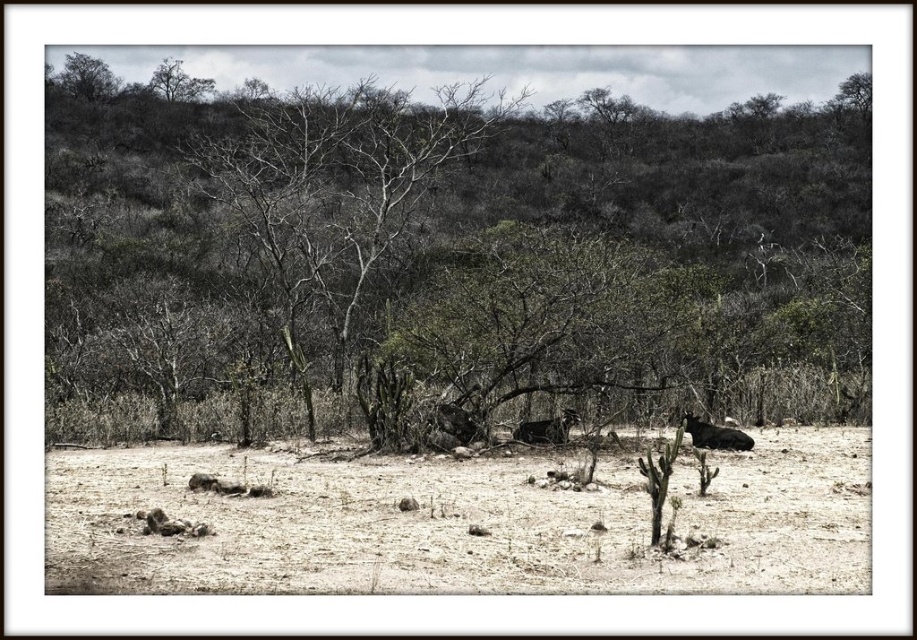
Question: Which point appears closest to the camera in this image?

Choices:
 (A) (759, 529)
 (B) (536, 435)
 (C) (780, 218)
 (D) (275, 122)

Answer: (A)

Question: Which object appears farthest from the camera in this image?

Choices:
 (A) bare branches at center
 (B) gray bark tree at upper left
 (C) brown dirt ground at center

Answer: (B)

Question: Is brown dirt ground at center below gray bark tree at upper left?

Choices:
 (A) yes
 (B) no

Answer: (A)

Question: Which object is closer to the camera taking this photo?

Choices:
 (A) bare branches at center
 (B) gray bark tree at upper left
 (C) dark brown fur at lower right

Answer: (C)

Question: In this image, where is dark green leafy tree at upper left located relative to dark brown fur at lower right?

Choices:
 (A) left
 (B) right

Answer: (A)

Question: In this image, where is dark green leafy tree at upper left located relative to dark brown fur at lower right?

Choices:
 (A) left
 (B) right

Answer: (A)